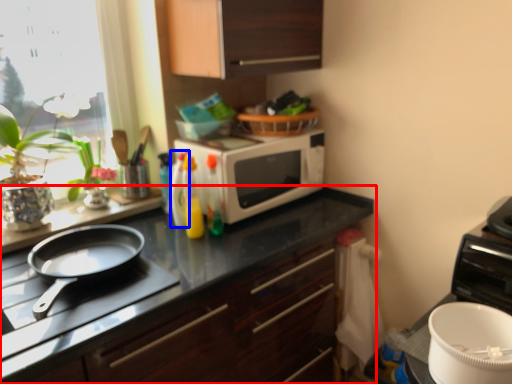
Question: Which point is further to the camera, cabinetry (highlighted by a red box) or bottle (highlighted by a blue box)?

Choices:
 (A) cabinetry
 (B) bottle

Answer: (B)